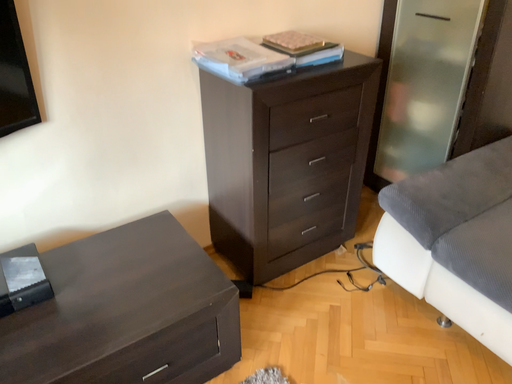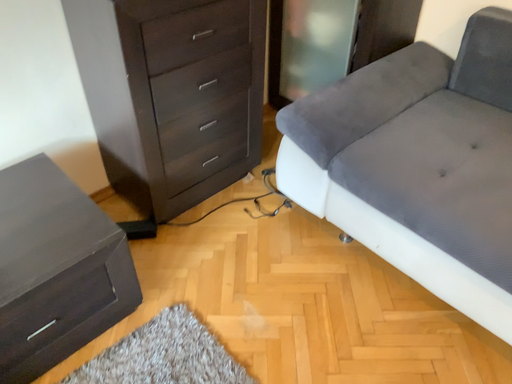
Question: Which way did the camera rotate in the video?

Choices:
 (A) rotated downward
 (B) rotated upward

Answer: (A)